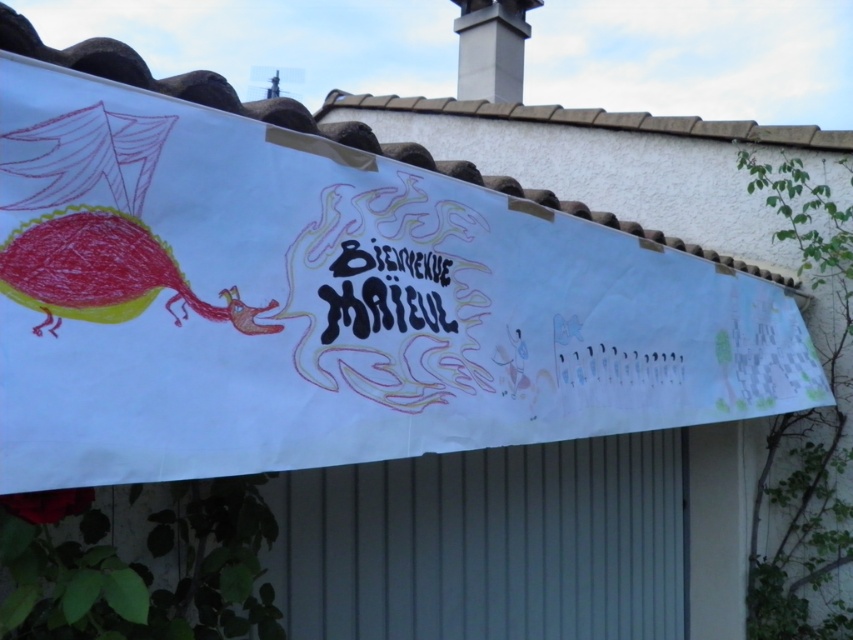
Question: Can you confirm if white paper banner at center is positioned to the right of white smooth chimney at upper center?

Choices:
 (A) no
 (B) yes

Answer: (B)

Question: Is white paper banner at center thinner than white smooth chimney at upper center?

Choices:
 (A) yes
 (B) no

Answer: (B)

Question: Which point is closer to the camera?

Choices:
 (A) (477, 0)
 (B) (473, 346)

Answer: (B)

Question: Which of the following is the farthest from the observer?

Choices:
 (A) (556, 368)
 (B) (511, 35)

Answer: (B)

Question: Which of the following is the farthest from the observer?

Choices:
 (A) white smooth chimney at upper center
 (B) white paper banner at center

Answer: (A)

Question: Where is white paper banner at center located in relation to white smooth chimney at upper center in the image?

Choices:
 (A) above
 (B) below

Answer: (B)